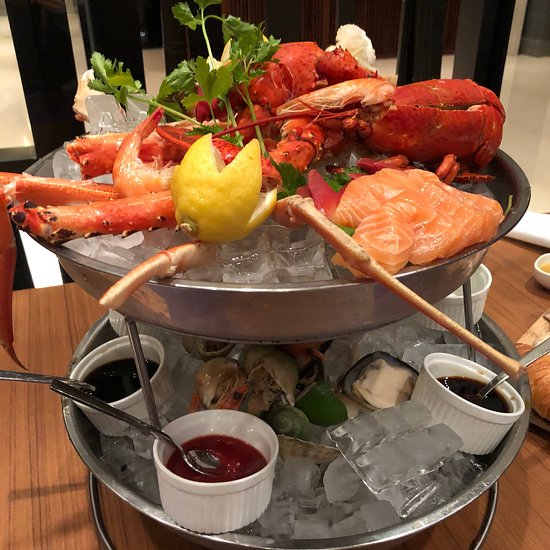
Find the location of a particular element. The image size is (550, 550). chair back is located at coordinates (495, 46), (34, 81).